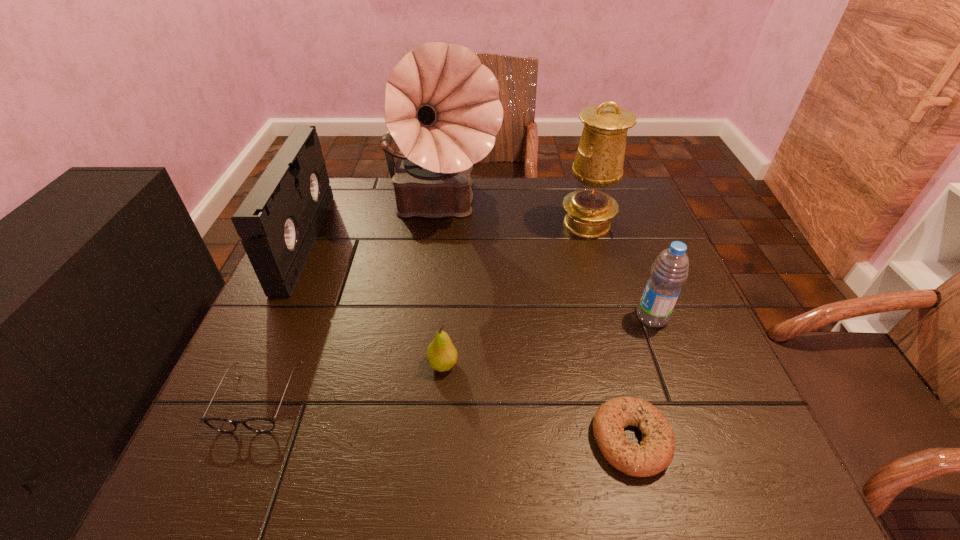
At what (x,y) coordinates should I click in order to perform the action: click on vacant space located on the back of the water bottle. Please return your answer as a coordinate pair (x, y). Looking at the image, I should click on (610, 207).

At what (x,y) coordinates should I click in order to perform the action: click on vacant region located 0.230m on the right of the pear. Please return your answer as a coordinate pair (x, y). Looking at the image, I should click on (575, 364).

Where is `vacant position located on the back of the bagel`? Image resolution: width=960 pixels, height=540 pixels. vacant position located on the back of the bagel is located at coordinates [612, 367].

In order to click on record player that is at the far edge in this screenshot , I will do `click(442, 109)`.

The height and width of the screenshot is (540, 960). I want to click on oil lamp that is at the far edge, so click(599, 160).

At what (x,y) coordinates should I click in order to perform the action: click on videotape at the far edge. Please return your answer as a coordinate pair (x, y). Looking at the image, I should click on (279, 220).

Where is `object situated at the near edge`? This screenshot has height=540, width=960. object situated at the near edge is located at coordinates (655, 453).

At what (x,y) coordinates should I click in order to perform the action: click on videotape present at the left edge. Please return your answer as a coordinate pair (x, y). Looking at the image, I should click on (279, 220).

In order to click on spectacles that is at the left edge in this screenshot , I will do `click(261, 425)`.

This screenshot has height=540, width=960. What are the coordinates of `oil lamp that is at the right edge` in the screenshot? It's located at (599, 160).